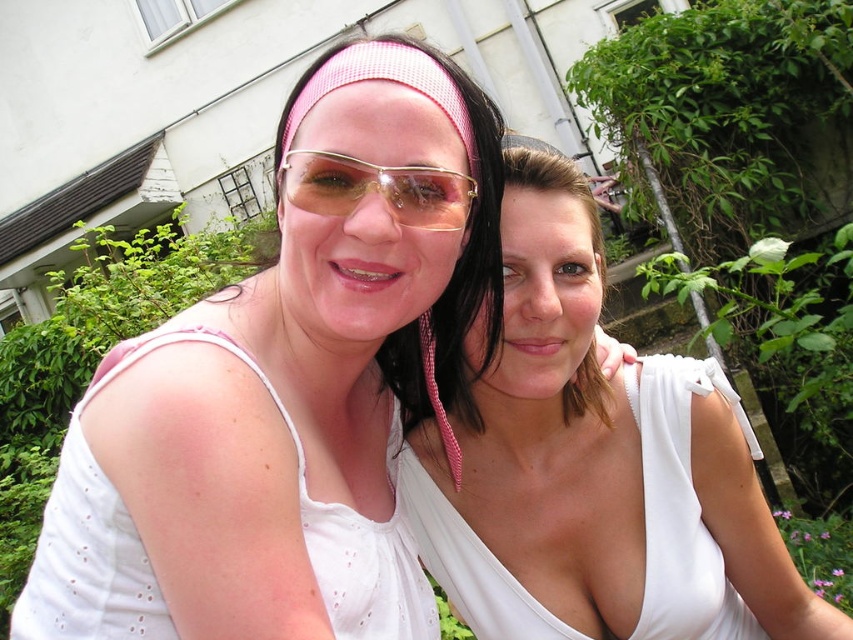
Which is above, white silky dress at center or pink mesh headband at center?

pink mesh headband at center is above.

This screenshot has width=853, height=640. What do you see at coordinates (682, 508) in the screenshot? I see `white silky dress at center` at bounding box center [682, 508].

Locate an element on the screen. white silky dress at center is located at coordinates [682, 508].

Is white lace dress at upper left wider than gold metallic sunglasses at center?

Yes, white lace dress at upper left is wider than gold metallic sunglasses at center.

What do you see at coordinates (149, 561) in the screenshot?
I see `white lace dress at upper left` at bounding box center [149, 561].

Find the location of a particular element. This screenshot has height=640, width=853. white lace dress at upper left is located at coordinates (149, 561).

Which is more to the left, matte white tank top at center or white silky dress at center?

Positioned to the left is matte white tank top at center.

The image size is (853, 640). Describe the element at coordinates (276, 401) in the screenshot. I see `matte white tank top at center` at that location.

Which is in front, point (132, 480) or point (517, 609)?

Point (132, 480) is more forward.

The height and width of the screenshot is (640, 853). Identify the location of matte white tank top at center. (276, 401).